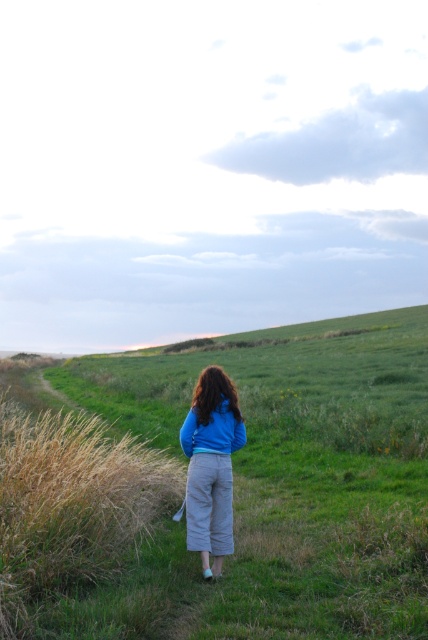
You are a photographer trying to capture the person in the scene. You want to ensure both the blue cotton jacket at center and the blue fleece sweatshirt at center are clearly visible in your shot. Given their sizes, which one might you need to focus on more to ensure it doesn

The blue cotton jacket at center is bigger than the blue fleece sweatshirt at center, so you should focus on capturing the blue cotton jacket at center first since it occupies more space and will be easier to see. However, both should be in frame as they are central to the scene.

You are a fashion designer observing the two blue jackets in the image. Which one is taller, the blue cotton jacket at center or the blue fleece sweatshirt at center?

The blue cotton jacket at center is taller than the blue fleece sweatshirt at center according to the description.